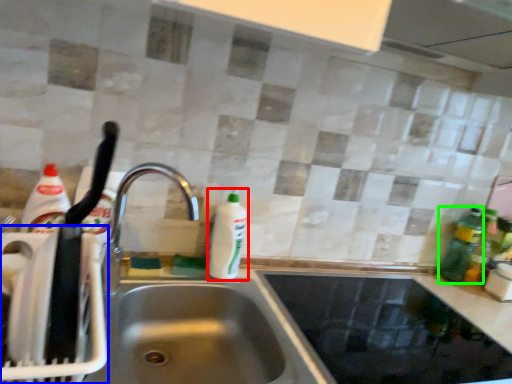
Question: Which object is the closest to the cleaning product (highlighted by a red box)? Choose among these: appliance (highlighted by a blue box) or bottle (highlighted by a green box).

Choices:
 (A) appliance
 (B) bottle

Answer: (A)